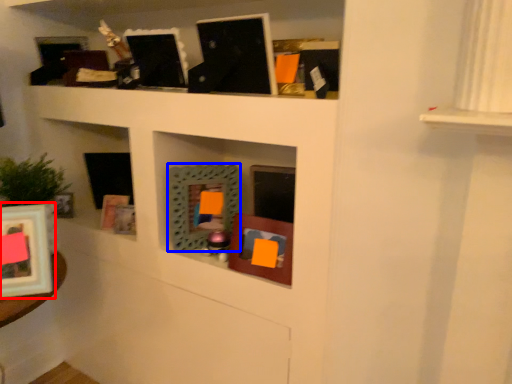
Question: Which of the following is the closest to the observer, picture frame (highlighted by a red box) or picture frame (highlighted by a blue box)?

Choices:
 (A) picture frame
 (B) picture frame

Answer: (A)